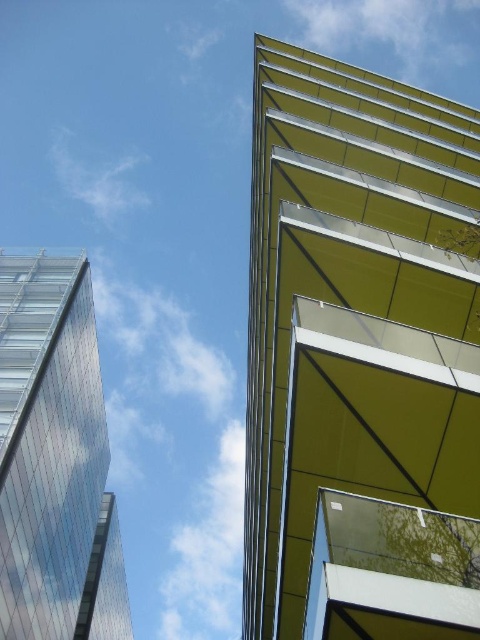
You are an architect evaluating the two buildings in the image. Which building would you say is taller between the yellow glass building at upper right and the transparent glass building at left?

The yellow glass building at upper right is much taller than the transparent glass building at left.

Based on the coordinates given in the image, can you identify which building the point at (360, 356) corresponds to?

The point at (360, 356) corresponds to the yellow glass building at upper right.

You are an architect analyzing the spatial relationship between the two buildings in the image. Which building is positioned higher in the scene, the yellow glass building at upper right or the transparent glass building at left?

The yellow glass building at upper right is located above the transparent glass building at left, so it is positioned higher in the scene.